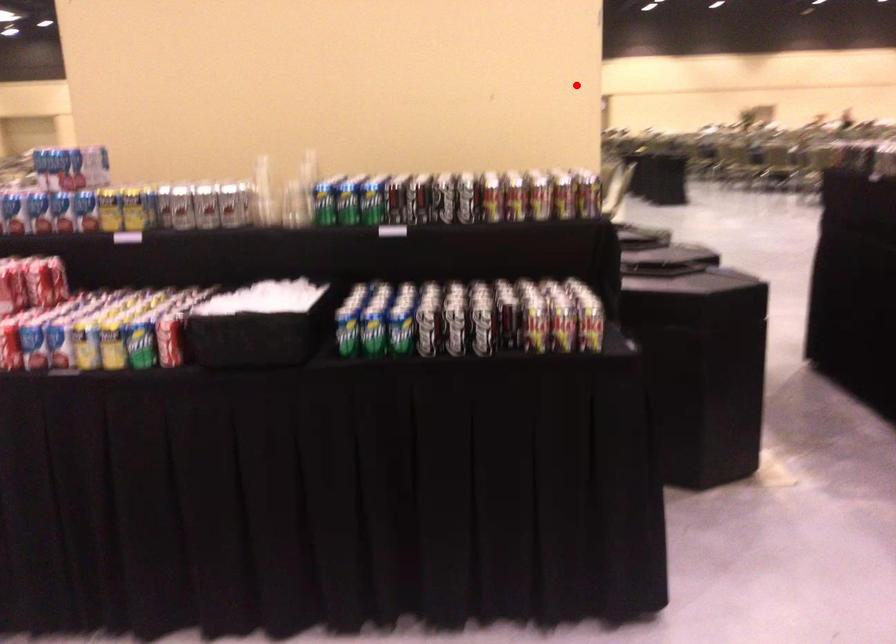
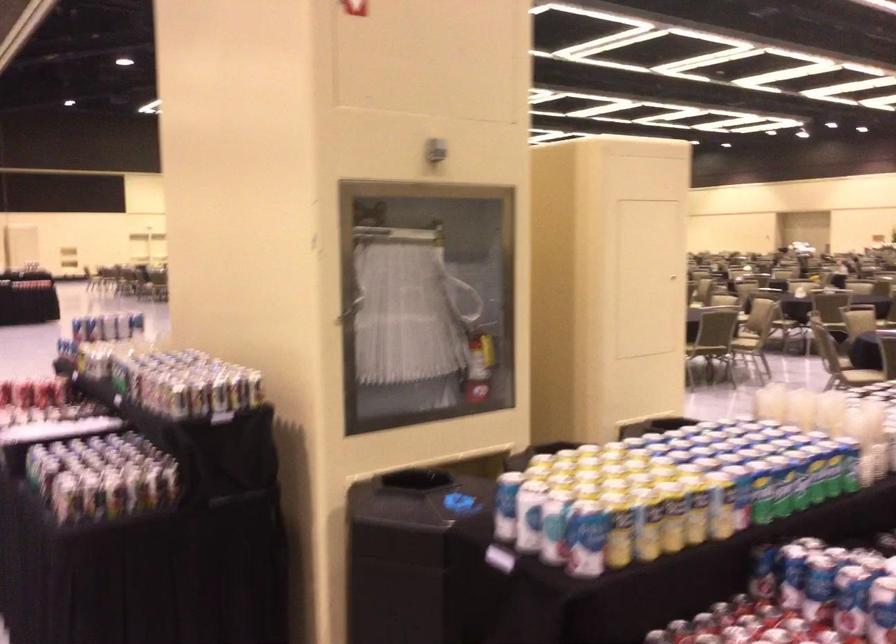
Question: A red point is marked in image1. In image2, is the corresponding 3D point closer to the camera or farther? Reply with the corresponding letter.

Choices:
 (A) The corresponding 3D point is closer.
 (B) The corresponding 3D point is farther.

Answer: (B)